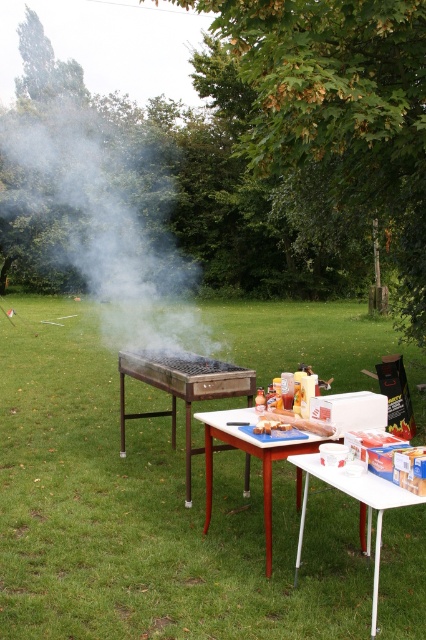
You are planning to set up a picnic blanket between the green grass at center and the wooden grill at center. The picnic blanket is 6 feet long. Will it fit between them without overlapping either the grass or the grill?

The green grass at center is 5.95 feet away from the wooden grill at center. Since the picnic blanket is 6 feet long, it will not fit between them without overlapping either the grass or the grill because the distance is slightly less than the blanket length.